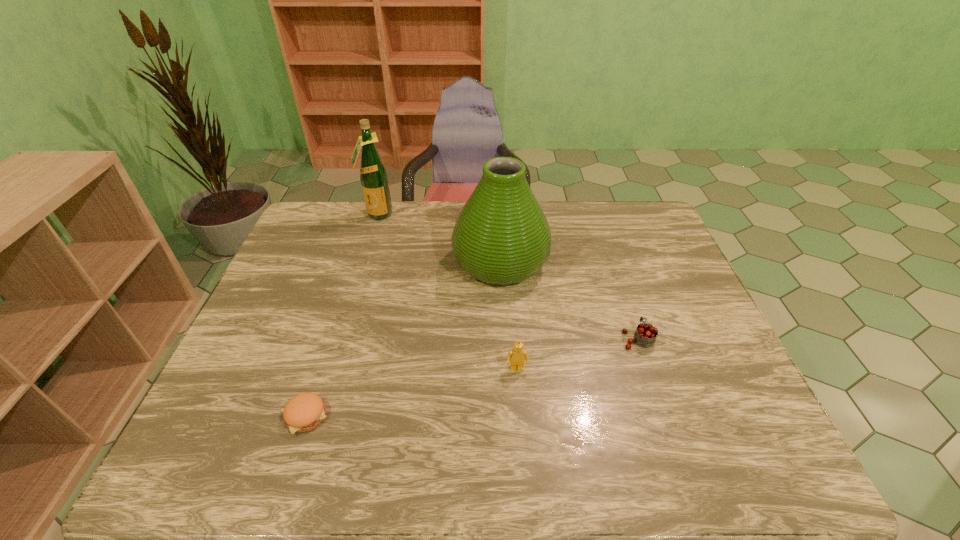
You are a GUI agent. You are given a task and a screenshot of the screen. Output one action in this format:
    pyautogui.click(x=<x>, y=<y>)
    Task: Click on the farthest object
    
    Given the screenshot: What is the action you would take?
    pyautogui.click(x=374, y=181)

You are a GUI agent. You are given a task and a screenshot of the screen. Output one action in this format:
    pyautogui.click(x=<x>, y=<y>)
    Task: Click on the fourth nearest object
    This screenshot has width=960, height=540.
    Given the screenshot: What is the action you would take?
    pyautogui.click(x=501, y=236)

Locate an element on the screen. Lego is located at coordinates (517, 356).

Where is `the third nearest object`? the third nearest object is located at coordinates (645, 335).

You are a GUI agent. You are given a task and a screenshot of the screen. Output one action in this format:
    pyautogui.click(x=<x>, y=<y>)
    Task: Click on the cherry
    This screenshot has width=960, height=540.
    Given the screenshot: What is the action you would take?
    pyautogui.click(x=645, y=335)

Locate an element on the screen. Image resolution: width=960 pixels, height=540 pixels. patty is located at coordinates (304, 412).

This screenshot has height=540, width=960. I want to click on the shortest object, so click(x=304, y=412).

Locate an element on the screen. The height and width of the screenshot is (540, 960). blank space located 0.050m on the front-facing side of the liquor is located at coordinates (372, 231).

This screenshot has height=540, width=960. Identify the location of vacant space located 0.190m on the front of the vase. (505, 349).

Locate an element on the screen. This screenshot has width=960, height=540. blank space located on the face of the Lego is located at coordinates (520, 412).